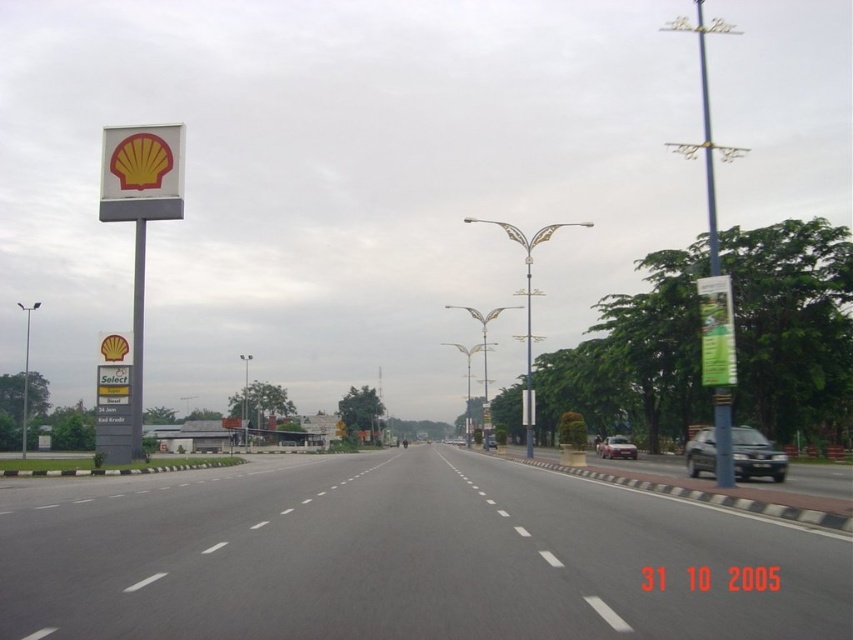
Between metallic silver sedan at center and metallic silver car at center, which one appears on the right side from the viewer's perspective?

From the viewer's perspective, metallic silver sedan at center appears more on the right side.

Which is above, metallic silver sedan at center or metallic silver car at center?

Positioned higher is metallic silver sedan at center.

Is point (598, 444) behind point (483, 438)?

No, it is in front of (483, 438).

Find the location of `metallic silver sedan at center`. metallic silver sedan at center is located at coordinates (618, 448).

Can you confirm if metallic gray signpost at left is positioned to the left of metallic silver sedan at center?

Correct, you'll find metallic gray signpost at left to the left of metallic silver sedan at center.

Does point (137, 308) come farther from viewer compared to point (608, 448)?

No, it is not.

This screenshot has width=853, height=640. Describe the element at coordinates (137, 337) in the screenshot. I see `metallic gray signpost at left` at that location.

Locate an element on the screen. metallic gray signpost at left is located at coordinates (137, 337).

Is metallic pole at center smaller than metallic silver car at center?

No, metallic pole at center is not smaller than metallic silver car at center.

Who is more distant from viewer, (527,360) or (492,444)?

Positioned behind is point (527,360).

Where is `metallic pole at center`? metallic pole at center is located at coordinates pos(527,360).